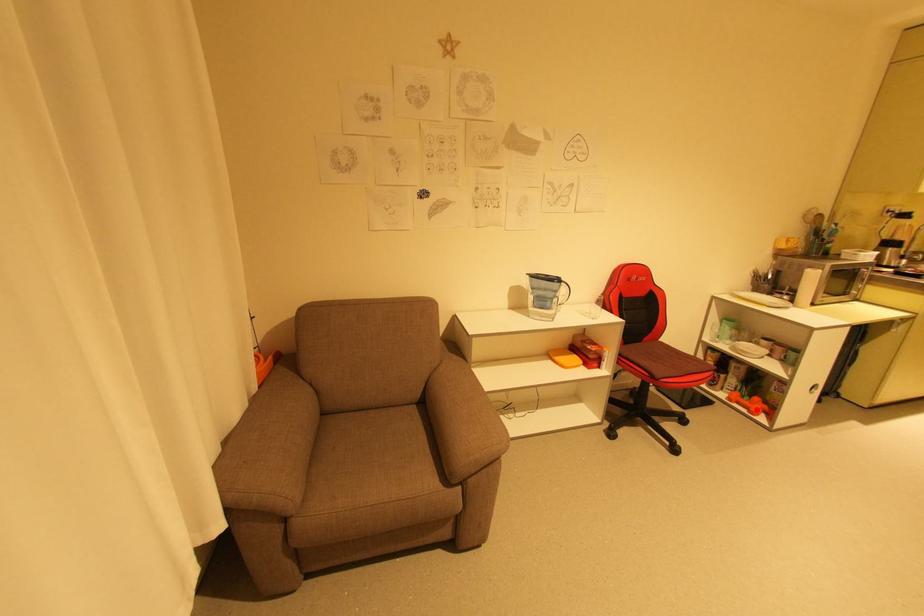
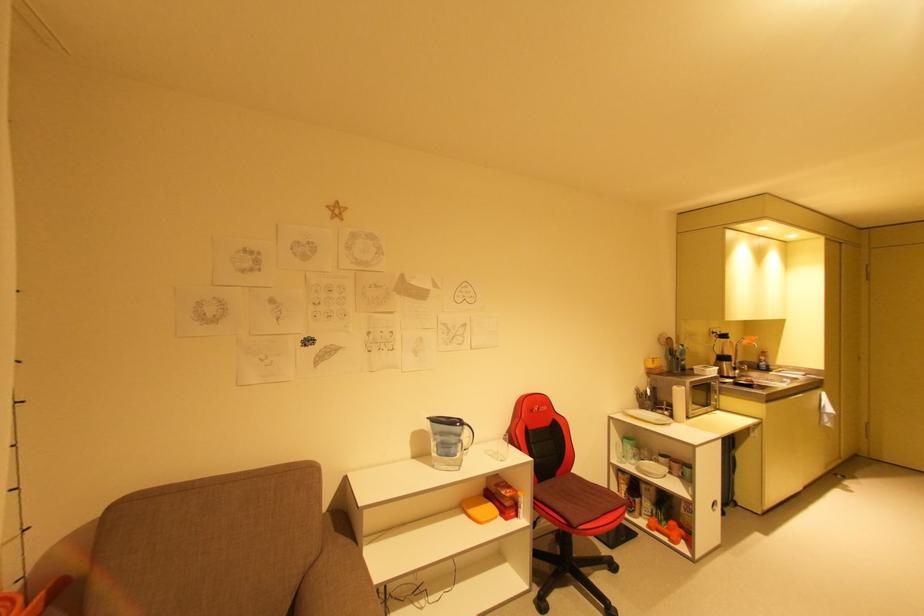
In the second image, find the point that corresponds to the highlighted location in the first image.

(675, 538)